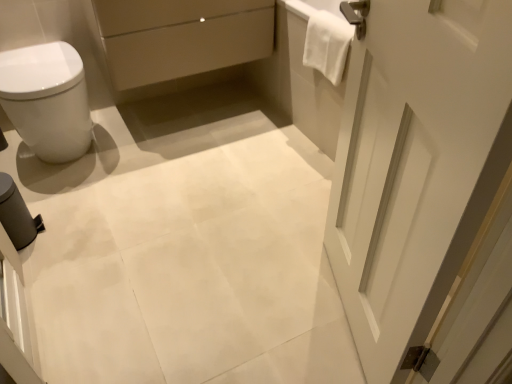
Question: Does white matte door at right have a larger size compared to white glossy bidet at left?

Choices:
 (A) yes
 (B) no

Answer: (A)

Question: Could white glossy bidet at left be considered to be inside white matte door at right?

Choices:
 (A) yes
 (B) no

Answer: (B)

Question: Can you confirm if white matte door at right is taller than white glossy bidet at left?

Choices:
 (A) yes
 (B) no

Answer: (A)

Question: From a real-world perspective, is white matte door at right physically above white glossy bidet at left?

Choices:
 (A) yes
 (B) no

Answer: (A)

Question: Is white matte door at right far away from white glossy bidet at left?

Choices:
 (A) no
 (B) yes

Answer: (B)

Question: Can you confirm if white matte door at right is smaller than white glossy bidet at left?

Choices:
 (A) yes
 (B) no

Answer: (B)

Question: Considering the relative positions of matte beige drawer at upper center and white towel at upper right in the image provided, is matte beige drawer at upper center to the right of white towel at upper right from the viewer's perspective?

Choices:
 (A) no
 (B) yes

Answer: (A)

Question: Is matte beige drawer at upper center positioned beyond the bounds of white towel at upper right?

Choices:
 (A) yes
 (B) no

Answer: (A)

Question: From a real-world perspective, is matte beige drawer at upper center on white towel at upper right?

Choices:
 (A) yes
 (B) no

Answer: (B)

Question: From the image's perspective, is matte beige drawer at upper center located beneath white towel at upper right?

Choices:
 (A) yes
 (B) no

Answer: (B)

Question: Could white towel at upper right be considered to be inside matte beige drawer at upper center?

Choices:
 (A) no
 (B) yes

Answer: (A)

Question: Would you consider matte beige drawer at upper center to be distant from white towel at upper right?

Choices:
 (A) yes
 (B) no

Answer: (B)

Question: Is white towel at upper right positioned behind matte beige drawer at upper center?

Choices:
 (A) yes
 (B) no

Answer: (B)